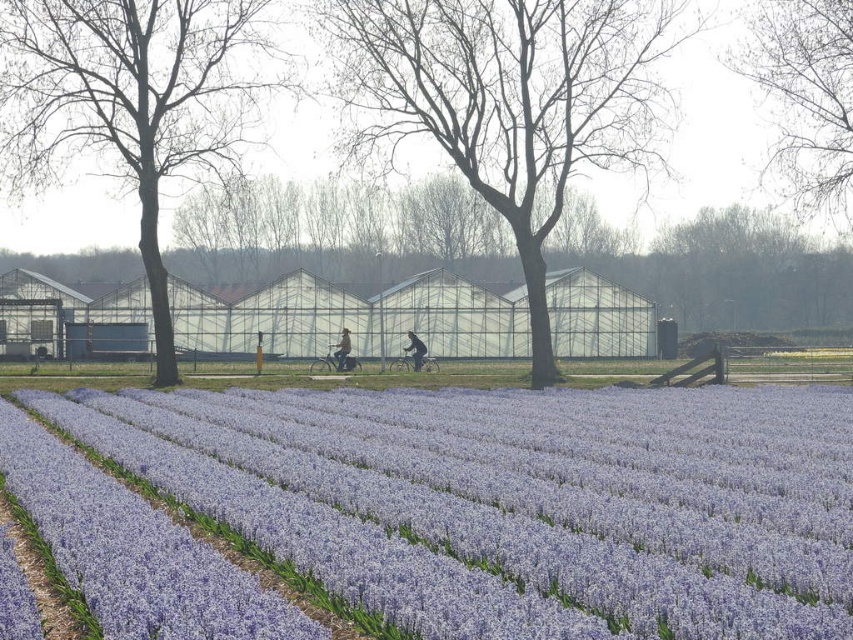
You are standing in the field of purple flowers and notice a bare wood tree at left and a light brown leather jacket at center. Which object is positioned more to the left side of the image?

The bare wood tree at left is positioned more to the left side of the image than the light brown leather jacket at center.

From the picture: You are standing at the point marked by point (132,100) in the image, which is a bare wood tree at left. You want to walk towards the greenhouse structures to the left. Are you already at the greenhouses, or do you need to move towards them?

The point (132,100) marks a bare wood tree at left, which is located to the left side of the image where the greenhouse structures are. Since the greenhouses are on the left and the point is already at the left side, you are already at the greenhouses.

You are a hiker who wants to take a photo of the bare wood tree at left and the bare branches at upper right. Which one should you focus on first if you want to capture both in a single frame without moving your camera?

The bare wood tree at left should be focused on first because it is closer to the viewer than the bare branches at upper right, allowing both to be in the same frame without moving the camera.